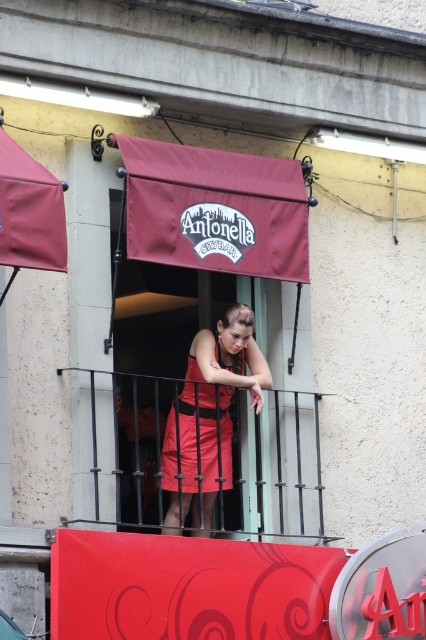
You are a photographer standing at the entrance of Antonella City Bar. You notice the black metal railing at center and the matte red dress at center in your viewfinder. Which object is positioned lower in the frame?

The black metal railing at center is positioned lower in the frame than the matte red dress at center, as it is described to be below it.

Looking at this image, you are standing at the entrance of Antonella City Bar and want to reach the black metal railing at center. According to the coordinates provided, is the railing closer to the top or bottom of the image?

The black metal railing at center is located at point coordinates with a y value of 0.643, which places it closer to the bottom of the image since lower y values are typically at the bottom in coordinate systems.

Consider the image. You are standing at the entrance of Antonella City Bar and want to take a photo of the two points mentioned. Which point, point (193, 408) or point (210, 422), will appear larger in your camera view?

Point (193, 408) will appear larger in the camera view because it is closer to the camera than point (210, 422).